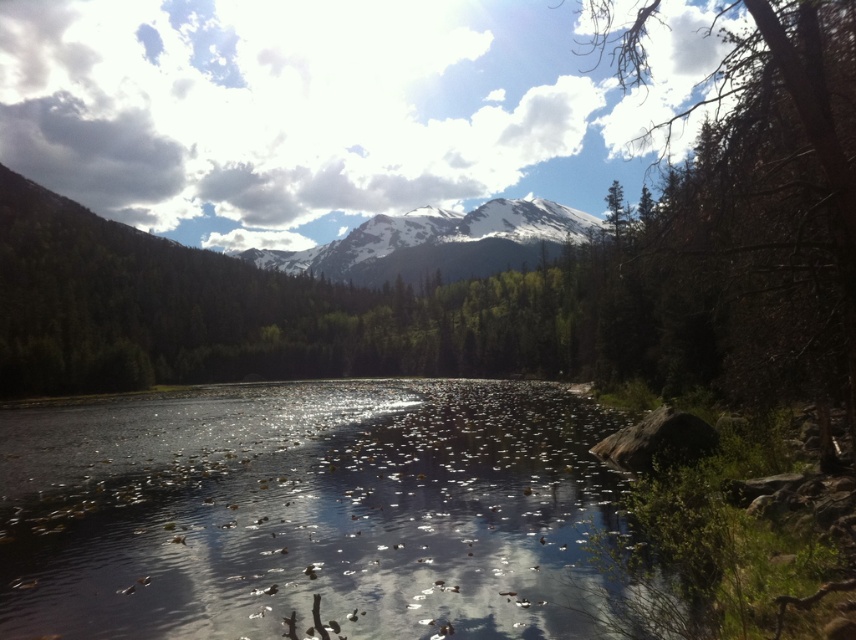
In the scene shown: You are a photographer planning to take a landscape photo of the translucent water at center and the snowy white mountain at center. Based on their positions, which object will appear closer to you in the photo?

The translucent water at center will appear closer to you in the photo because it is positioned in front of the snowy white mountain at center.

In the scene shown: You are an environmental scientist observing the lake and its surroundings. You notice the translucent water at center and the green leafy tree at center. Which object appears narrower in the image?

The translucent water at center is thinner than the green leafy tree at center, so the translucent water at center appears narrower.

You are standing on the lakeshore and notice the translucent water at center and the green leafy tree at center. Which object appears smaller in the scene?

The translucent water at center appears smaller than the green leafy tree at center in the scene.